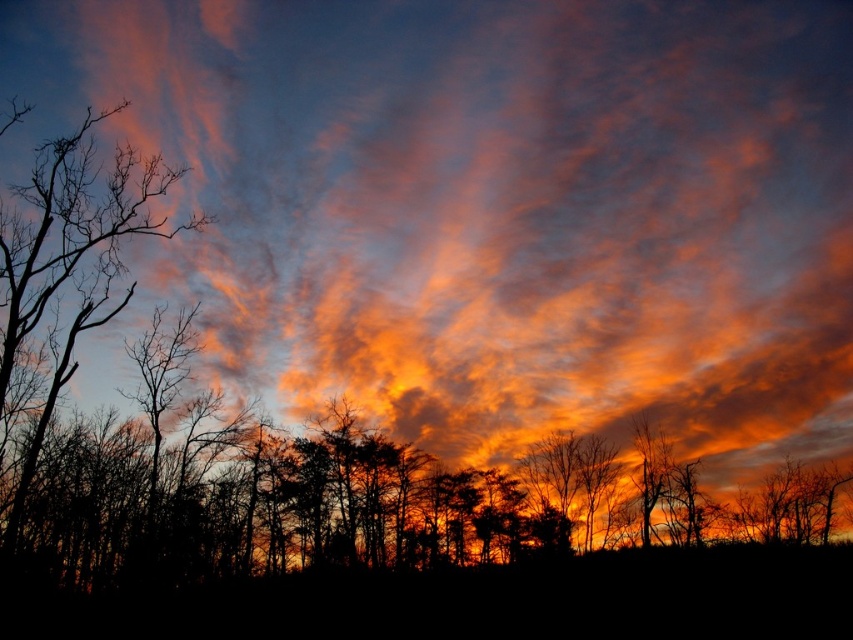
Question: Can you confirm if silhouette tree at center is positioned above silhouette bare tree at left?

Choices:
 (A) no
 (B) yes

Answer: (A)

Question: Which point is closer to the camera taking this photo?

Choices:
 (A) (105, 250)
 (B) (410, 474)

Answer: (A)

Question: Can you confirm if silhouette tree at center is thinner than silhouette bare tree at left?

Choices:
 (A) yes
 (B) no

Answer: (B)

Question: Is silhouette tree at center to the left of silhouette bare tree at left from the viewer's perspective?

Choices:
 (A) yes
 (B) no

Answer: (B)

Question: Which object appears closest to the camera in this image?

Choices:
 (A) silhouette bare tree at left
 (B) silhouette tree at center

Answer: (A)

Question: Among these objects, which one is nearest to the camera?

Choices:
 (A) silhouette bare tree at left
 (B) silhouette tree at center

Answer: (A)